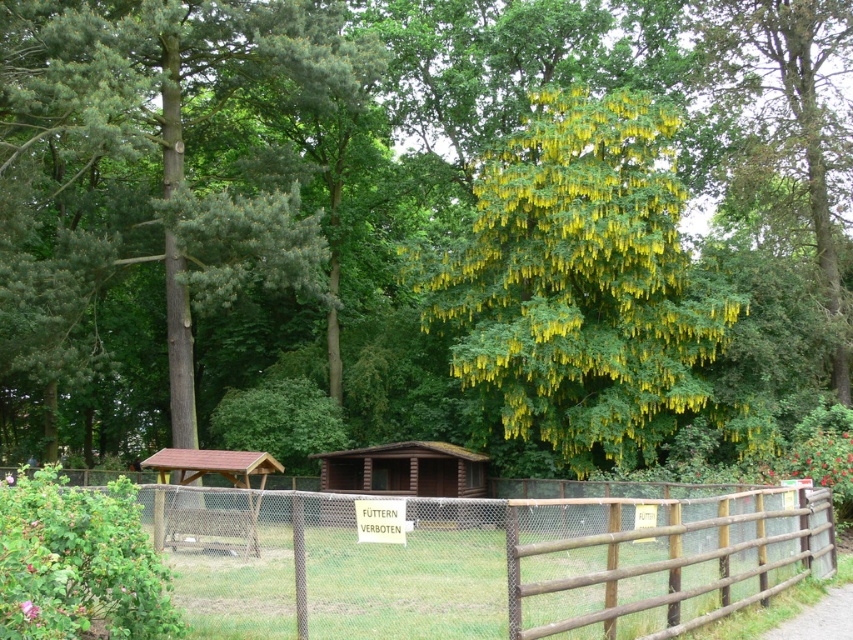
Question: Is green needle-like at left bigger than yellow matte flower at center?

Choices:
 (A) yes
 (B) no

Answer: (A)

Question: Does brown wooden fence at center have a lesser width compared to yellow-green foliage at center?

Choices:
 (A) yes
 (B) no

Answer: (A)

Question: Which of the following is the closest to the observer?

Choices:
 (A) (73, 328)
 (B) (28, 614)
 (C) (805, 627)

Answer: (B)

Question: Does green needle-like at left appear on the left side of brown wooden path at lower right?

Choices:
 (A) no
 (B) yes

Answer: (B)

Question: Which of the following is the closest to the observer?

Choices:
 (A) yellow-green foliage at center
 (B) yellow matte flower at center

Answer: (B)

Question: Which of these objects is positioned closest to the brown wooden path at lower right?

Choices:
 (A) yellow-green foliage at center
 (B) brown wooden fence at center
 (C) green needle-like at left

Answer: (B)